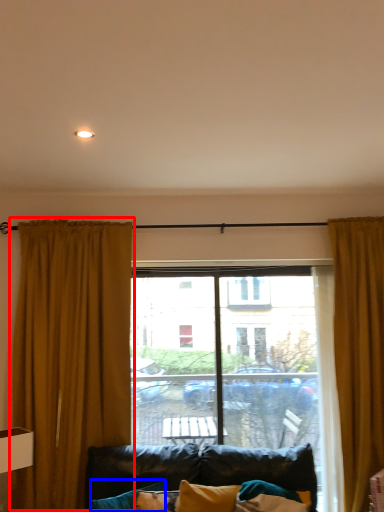
Question: Which object is closer to the camera taking this photo, curtain (highlighted by a red box) or pillow (highlighted by a blue box)?

Choices:
 (A) curtain
 (B) pillow

Answer: (B)